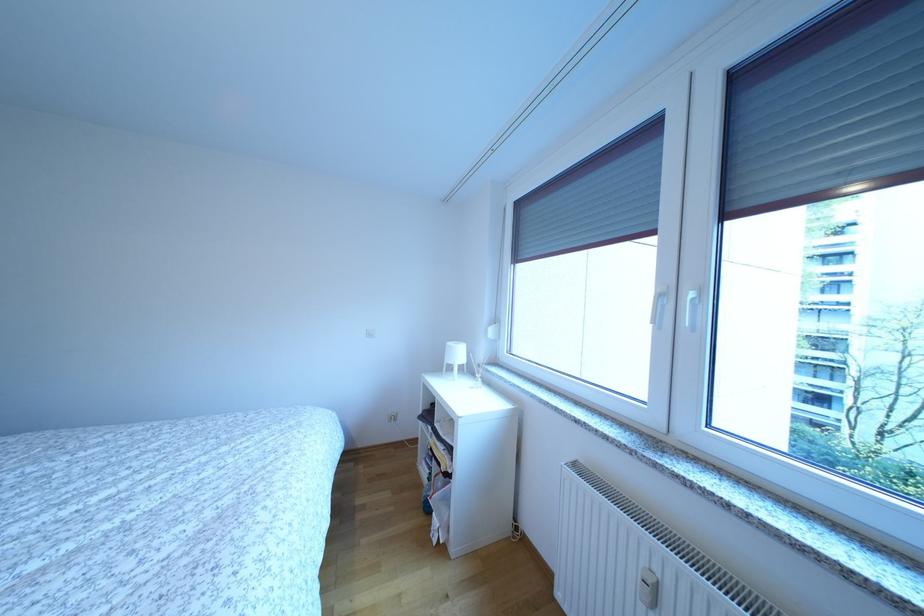
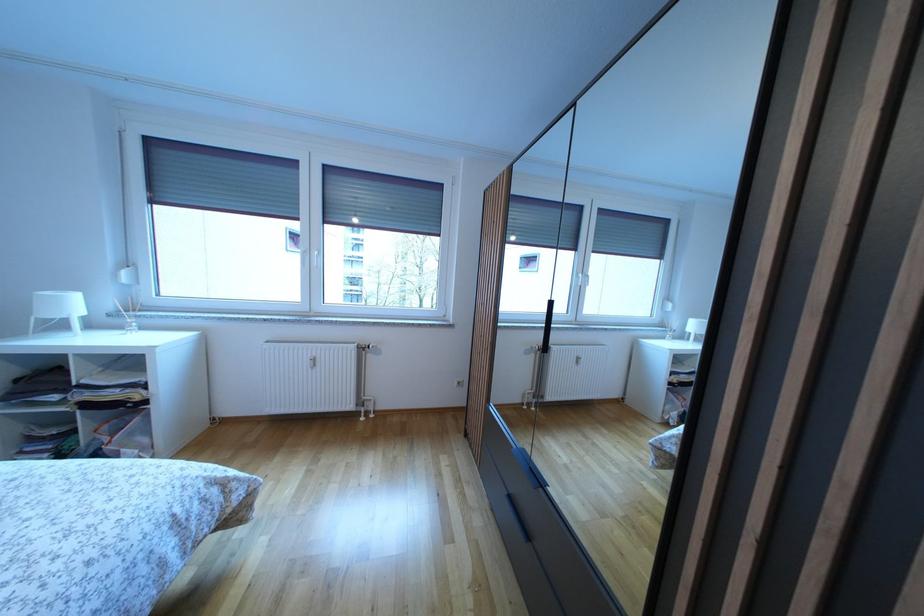
The point at (466, 360) is marked in the first image. Where is the corresponding point in the second image?

(78, 310)